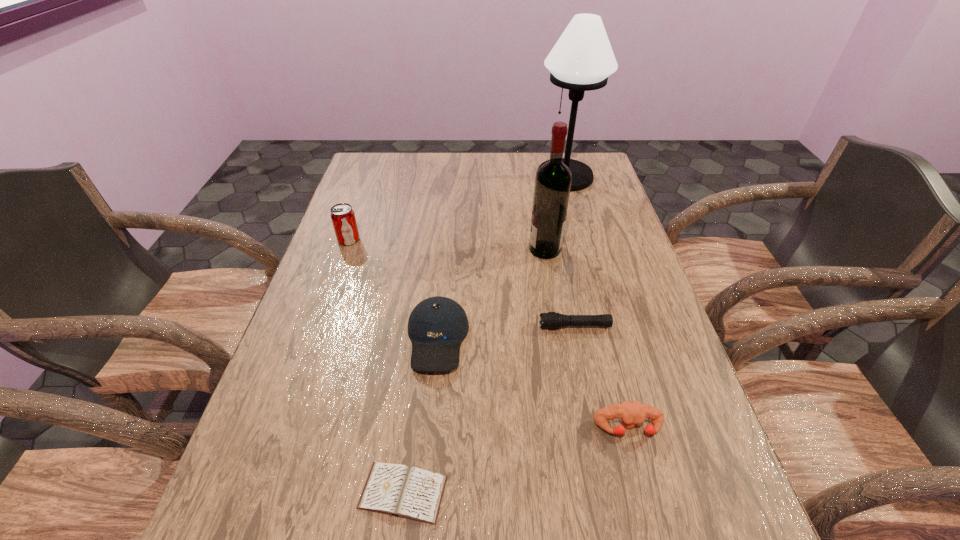
This screenshot has width=960, height=540. I want to click on free spot between the sixth tallest object and the nearest object, so click(x=489, y=409).

Identify the location of empty location between the shortest object and the flashlight. This screenshot has width=960, height=540. (489, 409).

This screenshot has height=540, width=960. I want to click on object that is the sixth nearest to the baseball cap, so click(x=582, y=59).

Image resolution: width=960 pixels, height=540 pixels. Find the location of `the fourth closest object relative to the shortest object`. the fourth closest object relative to the shortest object is located at coordinates (553, 179).

The width and height of the screenshot is (960, 540). What are the coordinates of `free spot that satisfies the following two spatial constraints: 1. on the front and back of the second tallest object; 2. on the front side of the diary` in the screenshot? It's located at (586, 492).

Locate an element on the screen. The image size is (960, 540). vacant position in the image that satisfies the following two spatial constraints: 1. on the front side of the table lamp; 2. on the front and back of the second tallest object is located at coordinates (585, 249).